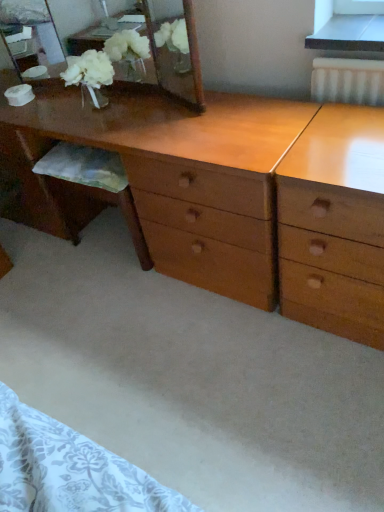
At what (x,y) coordinates should I click in order to perform the action: click on free space in front of wooden mirror at upper left. Please return your answer as a coordinate pair (x, y). The height and width of the screenshot is (512, 384). Looking at the image, I should click on (155, 131).